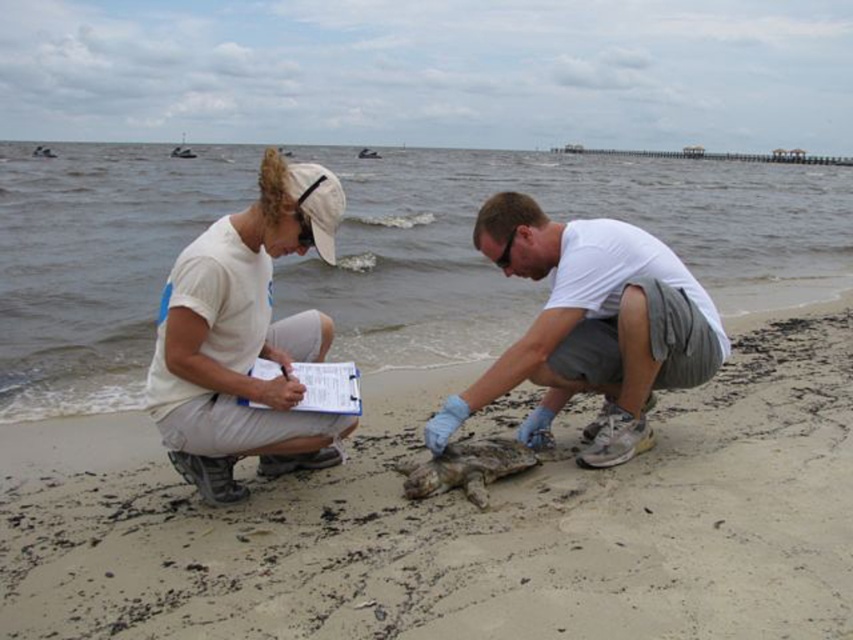
Question: Is white matte clipboard at upper left bigger than white paper clipboard at center?

Choices:
 (A) no
 (B) yes

Answer: (B)

Question: Which of the following is the closest to the observer?

Choices:
 (A) (618, 372)
 (B) (213, 237)

Answer: (B)

Question: Can you confirm if matte white shirt at center is positioned to the right of white paper clipboard at center?

Choices:
 (A) no
 (B) yes

Answer: (B)

Question: Does white matte clipboard at upper left appear under white paper clipboard at center?

Choices:
 (A) yes
 (B) no

Answer: (B)

Question: Based on their relative distances, which object is farther from the white paper clipboard at center?

Choices:
 (A) matte gray turtle at center
 (B) matte white shirt at center

Answer: (B)

Question: Based on their relative distances, which object is farther from the sandy beach at center?

Choices:
 (A) matte white shirt at center
 (B) white matte clipboard at upper left
 (C) white paper clipboard at center

Answer: (B)